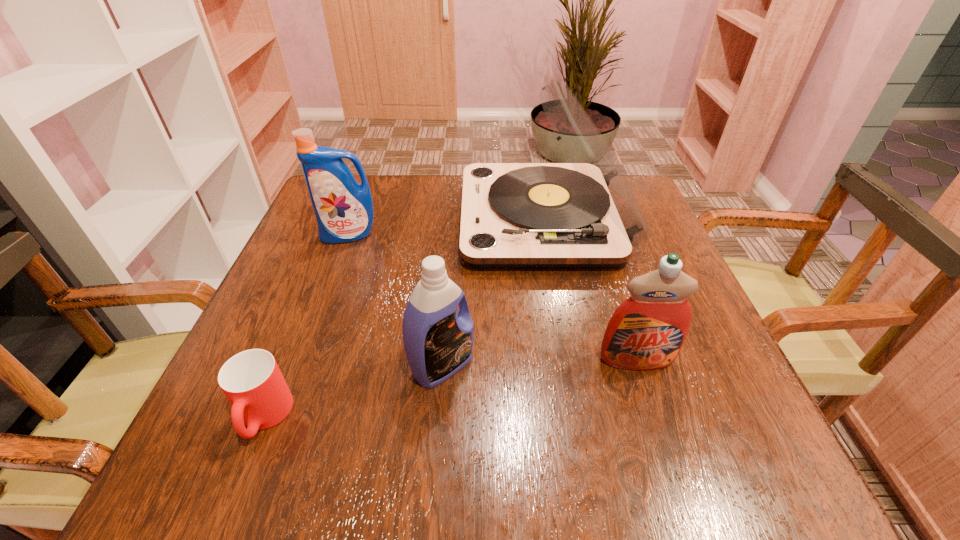
At what (x,y) coordinates should I click in order to perform the action: click on object situated at the far right corner. Please return your answer as a coordinate pair (x, y). This screenshot has width=960, height=540. Looking at the image, I should click on (584, 214).

At what (x,y) coordinates should I click in order to perform the action: click on vacant space at the far edge. Please return your answer as a coordinate pair (x, y). The image size is (960, 540). Looking at the image, I should click on (453, 222).

The height and width of the screenshot is (540, 960). In order to click on vacant space at the near edge of the desktop in this screenshot , I will do `click(446, 483)`.

This screenshot has height=540, width=960. Identify the location of vacant region at the left edge. (339, 244).

Find the location of a particular element. The height and width of the screenshot is (540, 960). free spot between the second detergent from left to right and the record player is located at coordinates (492, 293).

The image size is (960, 540). Identify the location of empty space between the shortest object and the second detergent from right to left. (353, 392).

The height and width of the screenshot is (540, 960). In order to click on vacant space in between the farthest detergent and the second detergent from right to left in this screenshot , I will do coord(396,300).

Image resolution: width=960 pixels, height=540 pixels. What are the coordinates of `vacant point located between the rightmost detergent and the farthest detergent` in the screenshot? It's located at (492, 297).

This screenshot has width=960, height=540. I want to click on vacant space in between the rightmost detergent and the tallest object, so click(x=590, y=289).

At what (x,y) coordinates should I click in order to perform the action: click on unoccupied position between the record player and the second detergent from left to right. Please return your answer as a coordinate pair (x, y). Looking at the image, I should click on (492, 293).